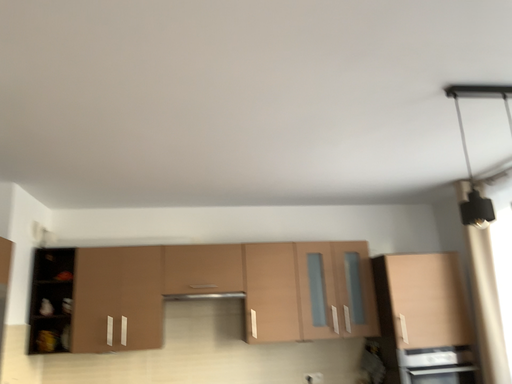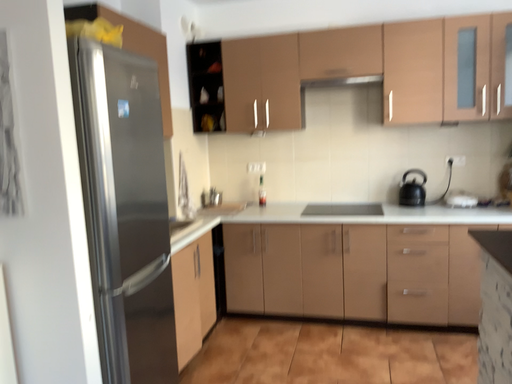
Question: How did the camera likely rotate when shooting the video?

Choices:
 (A) rotated upward
 (B) rotated downward

Answer: (B)